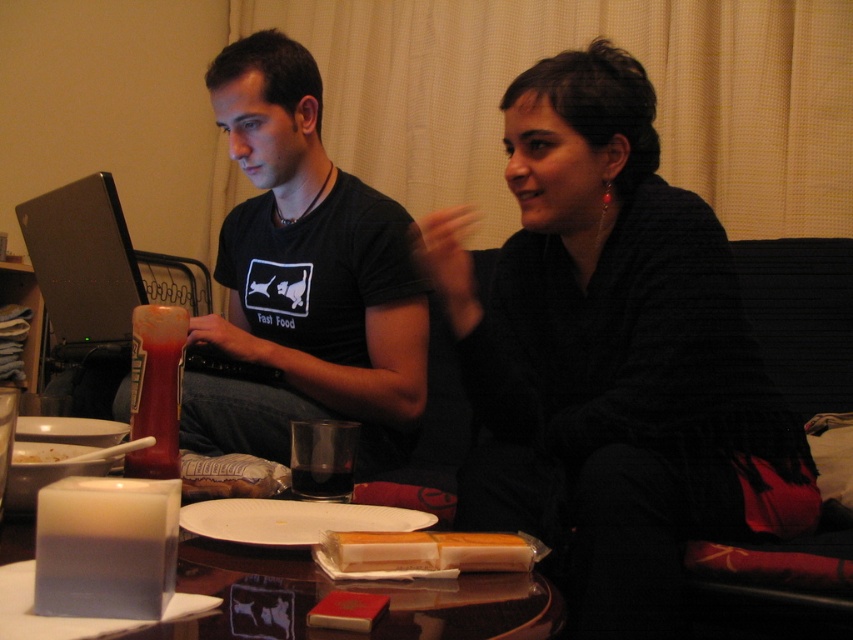
Who is positioned more to the left, black matte sweater at center or yellow cheese at center?

From the viewer's perspective, yellow cheese at center appears more on the left side.

Can you confirm if black matte sweater at center is smaller than yellow cheese at center?

No.

Does point (595, 72) lie behind point (512, 548)?

Yes, point (595, 72) is farther from viewer.

I want to click on black matte sweater at center, so click(x=612, y=356).

Can you confirm if silver metallic laptop at left is smaller than translucent glass cup at center?

No.

Measure the distance between point (51,202) and camera.

The distance of point (51,202) from camera is 1.57 meters.

Describe the element at coordinates (90, 268) in the screenshot. This screenshot has width=853, height=640. I see `silver metallic laptop at left` at that location.

At what (x,y) coordinates should I click in order to perform the action: click on silver metallic laptop at left. Please return your answer as a coordinate pair (x, y). This screenshot has height=640, width=853. Looking at the image, I should click on (90, 268).

Does matte black shirt at center come in front of silver metallic laptop at left?

Yes, it is.

Between matte black shirt at center and silver metallic laptop at left, which one has more height?

Standing taller between the two is matte black shirt at center.

I want to click on matte black shirt at center, so click(305, 276).

I want to click on matte black shirt at center, so click(305, 276).